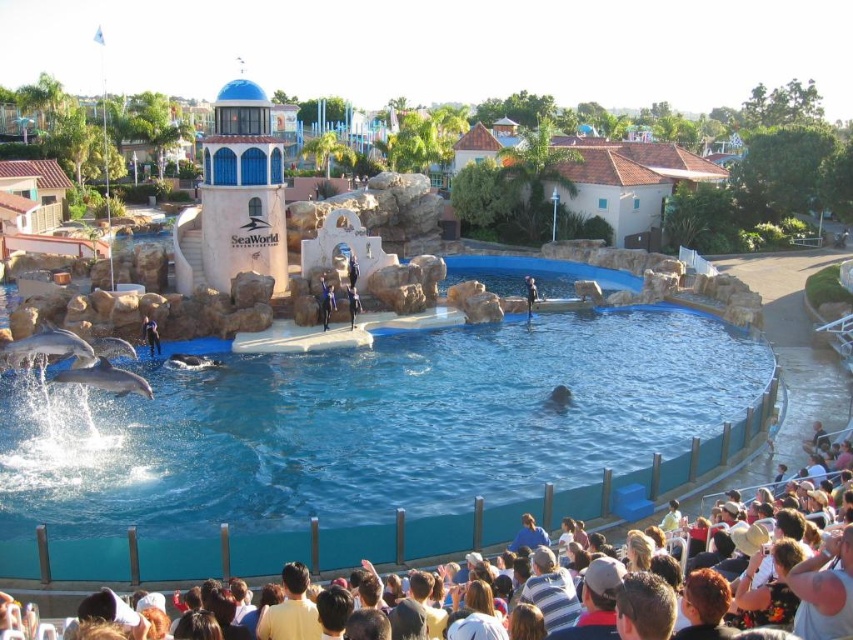
Is smooth gray dolphin at lower left to the left of white smooth dolphin at lower left from the viewer's perspective?

Correct, you'll find smooth gray dolphin at lower left to the left of white smooth dolphin at lower left.

Can you confirm if smooth gray dolphin at lower left is positioned above white smooth dolphin at lower left?

Yes, smooth gray dolphin at lower left is above white smooth dolphin at lower left.

Describe the element at coordinates (47, 348) in the screenshot. Image resolution: width=853 pixels, height=640 pixels. I see `smooth gray dolphin at lower left` at that location.

Identify the location of smooth gray dolphin at lower left. (47, 348).

This screenshot has width=853, height=640. I want to click on blonde hair at lower center, so click(x=477, y=616).

Where is `blonde hair at lower center`? Image resolution: width=853 pixels, height=640 pixels. blonde hair at lower center is located at coordinates (477, 616).

Looking at this image, between striped shirt at lower center and blonde hair at lower center, which one is positioned lower?

blonde hair at lower center

Does striped shirt at lower center have a larger size compared to blonde hair at lower center?

Result: Yes, striped shirt at lower center is bigger than blonde hair at lower center.

Is point (563, 588) farther from camera compared to point (488, 609)?

Yes, point (563, 588) is behind point (488, 609).

At what (x,y) coordinates should I click in order to perform the action: click on striped shirt at lower center. Please return your answer as a coordinate pair (x, y). Image resolution: width=853 pixels, height=640 pixels. Looking at the image, I should click on (550, 589).